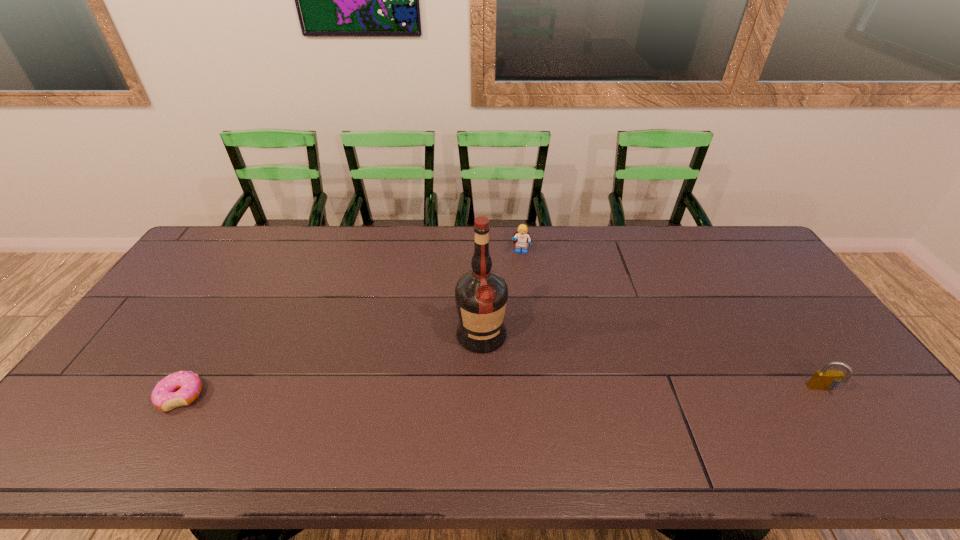
Find the location of a particular element. free spot located 0.200m on the surface of the tallest object is located at coordinates (500, 418).

Image resolution: width=960 pixels, height=540 pixels. I want to click on free space located on the surface of the tallest object, so click(492, 377).

Locate an element on the screen. vacant position located on the front-facing side of the third object from left to right is located at coordinates (518, 275).

This screenshot has height=540, width=960. Find the location of `vacant space located on the front-facing side of the third object from left to right`. vacant space located on the front-facing side of the third object from left to right is located at coordinates (518, 275).

Locate an element on the screen. The height and width of the screenshot is (540, 960). vacant position located on the front-facing side of the third object from left to right is located at coordinates (518, 277).

The width and height of the screenshot is (960, 540). Identify the location of object located in the far edge section of the desktop. (522, 237).

Locate an element on the screen. The height and width of the screenshot is (540, 960). doughnut situated at the near edge is located at coordinates (182, 388).

Where is `padlock located in the near edge section of the desktop`? The image size is (960, 540). padlock located in the near edge section of the desktop is located at coordinates coord(825,379).

Locate an element on the screen. The width and height of the screenshot is (960, 540). object that is at the right edge is located at coordinates (825, 379).

The width and height of the screenshot is (960, 540). What are the coordinates of `object at the near right corner` in the screenshot? It's located at (825, 379).